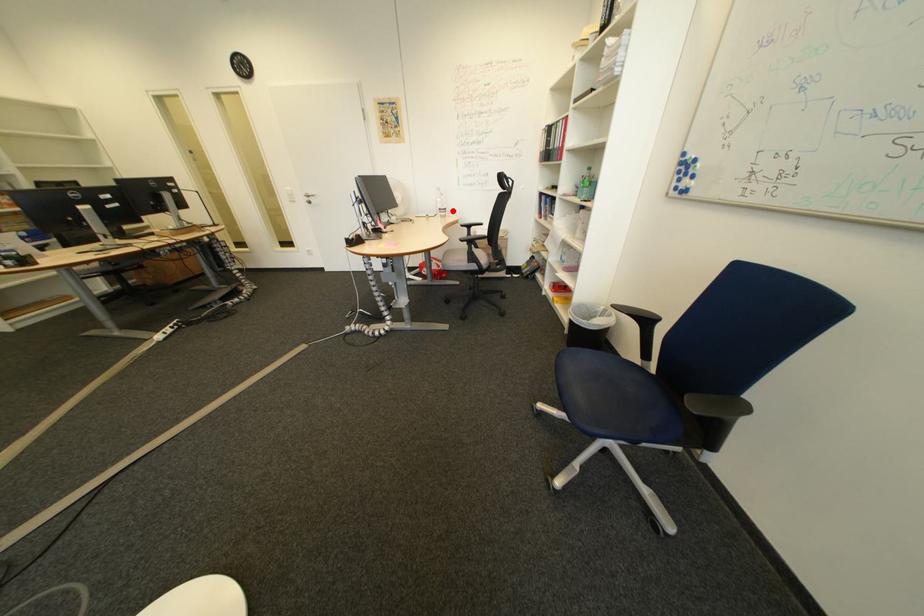
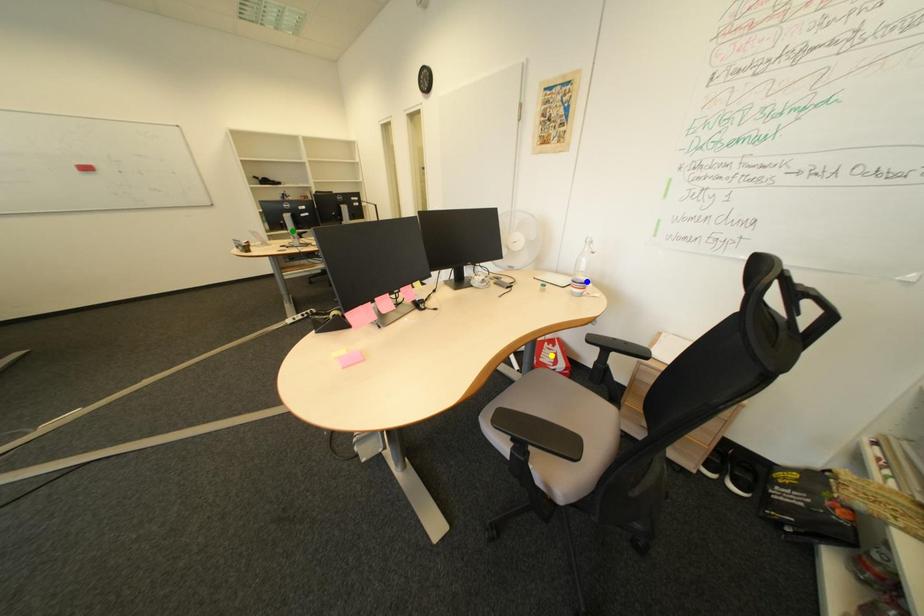
Question: I am providing you with two images of the same scene from different viewpoints. A red point is marked on the first image. You are given multiple points on the second image. Which mark in image 2 goes with the point in image 1?

Choices:
 (A) green point
 (B) blue point
 (C) yellow point

Answer: (B)